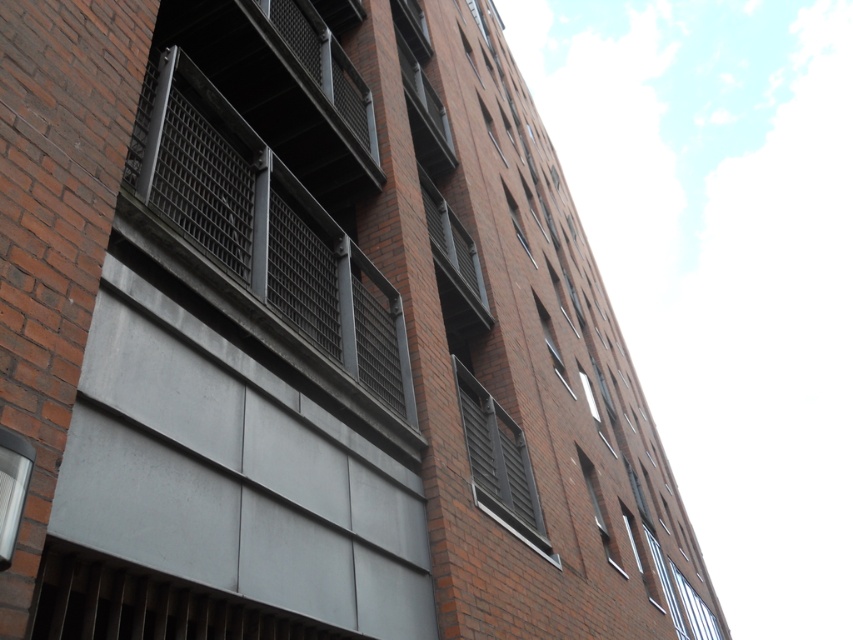
You are standing in front of a multi story brick building. You see two points marked on the building facade. The first point is at coordinate point (520, 513) and the second point is at coordinate point (677, 572). Which point is closer to you?

Point (520, 513) is in front of point (677, 572), so it is closer to you.

Based on the photo, you are an architect assessing the building facade. You notice the matte gray window at center and the clear glass window at lower right. Which window has a smaller width?

The matte gray window at center has a lesser width compared to the clear glass window at lower right, so the matte gray window at center is smaller in width.

You are standing on the ground floor of the building and want to clean the matte gray window at center. If your ladder can reach up to 4 meters, will it be sufficient to reach the window?

The matte gray window at center and viewer are 4.37 meters apart from each other. Since the ladder can only reach up to 4 meters, it is insufficient to reach the window.